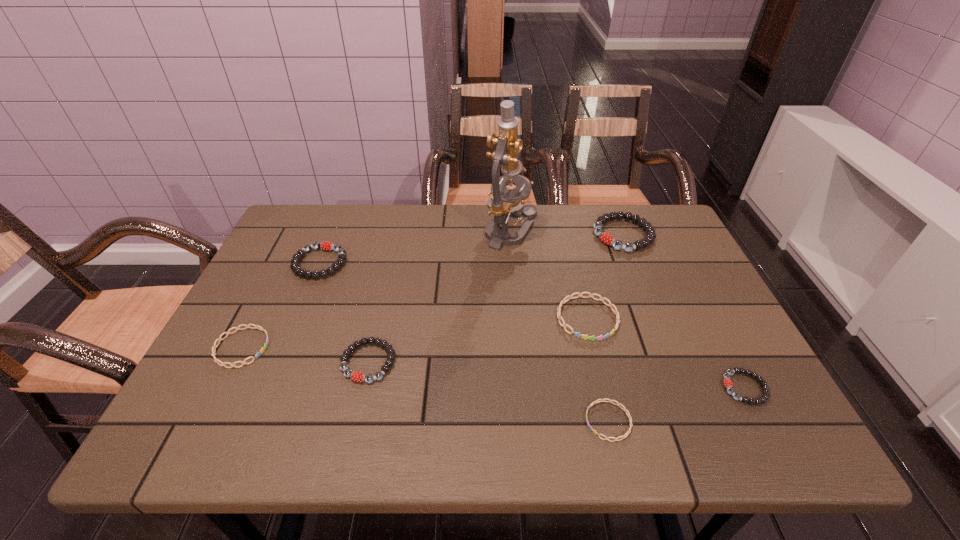
Identify the location of the smallest black bracelet. (727, 382).

Image resolution: width=960 pixels, height=540 pixels. I want to click on the smallest blue bracelet, so click(601, 400).

The height and width of the screenshot is (540, 960). Identify the location of the nearest blue bracelet. (601, 400).

The width and height of the screenshot is (960, 540). In order to click on vacant space positioned on the left of the fourth object from left to right in this screenshot , I will do `click(462, 232)`.

Find the location of a particular element. free space located on the front of the seventh shortest object is located at coordinates (674, 360).

Identify the location of free space located on the back of the sixth shortest object. The image size is (960, 540). (345, 205).

I want to click on free region located on the surface of the biggest blue bracelet showing star-shaped elements, so click(612, 416).

The image size is (960, 540). Identify the location of vacant space located on the back of the third bracelet from left to right. (390, 269).

Where is `vacant space located on the surface of the second smallest blue bracelet showing star-shaped elements`? The width and height of the screenshot is (960, 540). vacant space located on the surface of the second smallest blue bracelet showing star-shaped elements is located at coordinates (440, 347).

The image size is (960, 540). In order to click on vacant region located on the back of the smallest black bracelet in this screenshot , I will do `click(693, 288)`.